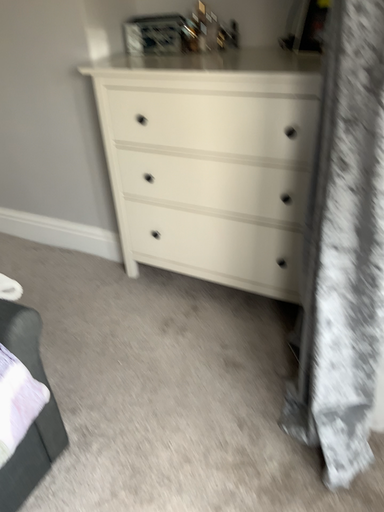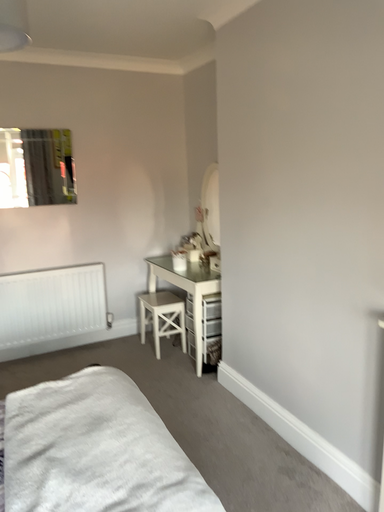
Question: How did the camera likely rotate when shooting the video?

Choices:
 (A) rotated downward
 (B) rotated upward

Answer: (B)